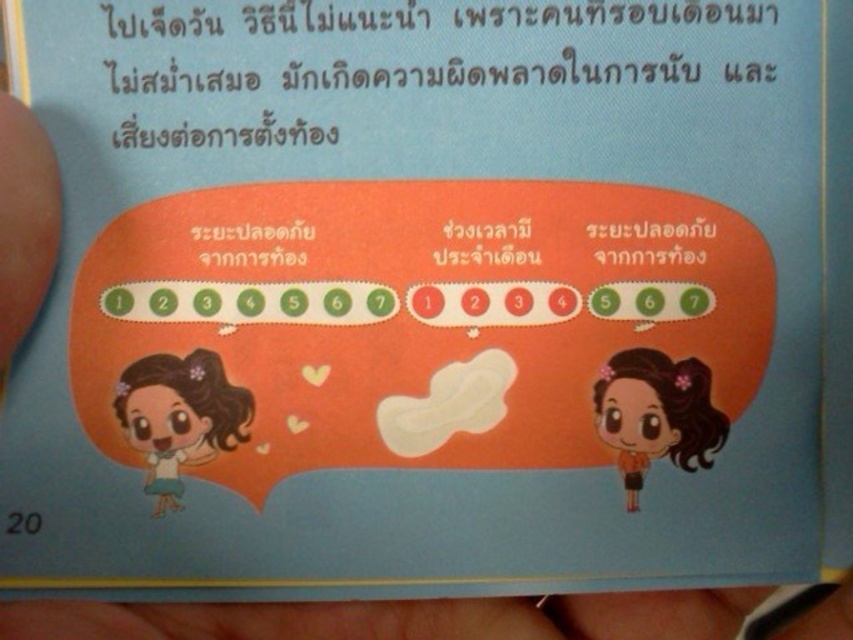
Between matte brown hair at left and orange matte hair at center, which one has more height?

Answer: Standing taller between the two is orange matte hair at center.

The width and height of the screenshot is (853, 640). I want to click on matte brown hair at left, so (178, 417).

Locate an element on the screen. The height and width of the screenshot is (640, 853). matte brown hair at left is located at coordinates (178, 417).